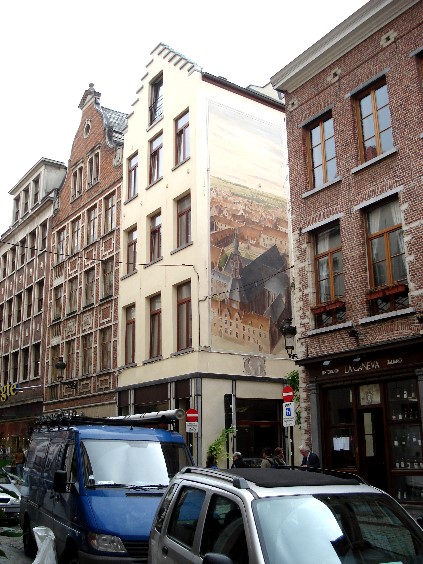
Where is `blue fan`? The width and height of the screenshot is (423, 564). blue fan is located at coordinates (107, 528).